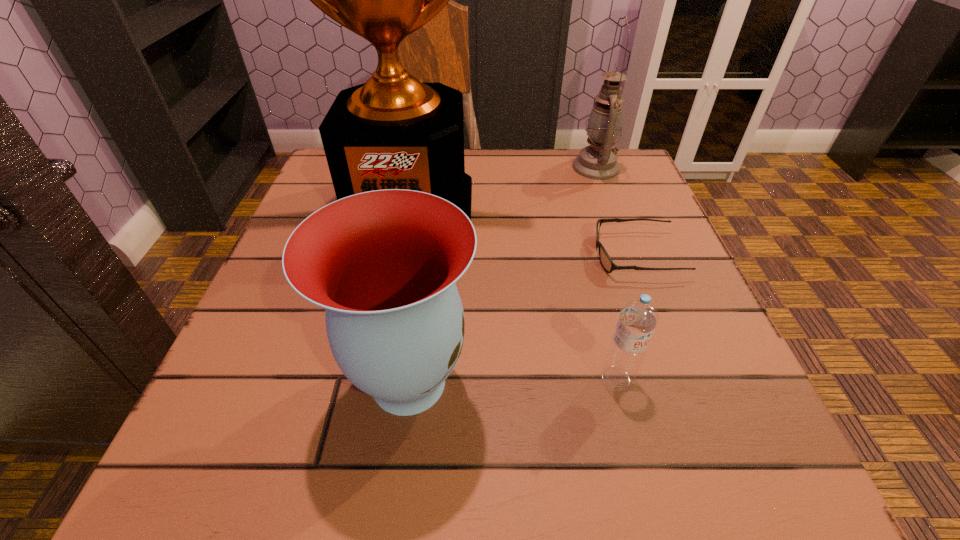
Find the location of a particular element. unoccupied area between the trophy cup and the water bottle is located at coordinates (512, 291).

Image resolution: width=960 pixels, height=540 pixels. Find the location of `vacant region between the third shortest object and the fourth tallest object`. vacant region between the third shortest object and the fourth tallest object is located at coordinates click(513, 381).

The image size is (960, 540). I want to click on blank region between the tallest object and the water bottle, so click(x=512, y=291).

At what (x,y) coordinates should I click in order to perform the action: click on vacant point located between the oil lamp and the second shortest object. Please return your answer as a coordinate pair (x, y). This screenshot has height=540, width=960. Looking at the image, I should click on (606, 273).

Locate which object is the closest to the second shortest object. Please provide its 2D coordinates. Your answer should be formatted as a tuple, i.e. [(x, y)], where the tuple contains the x and y coordinates of a point satisfying the conditions above.

[(606, 261)]

Image resolution: width=960 pixels, height=540 pixels. I want to click on object that is the third nearest to the third shortest object, so pos(606,261).

Locate an element on the screen. vacant space that satisfies the following two spatial constraints: 1. on the back side of the oil lamp; 2. on the left side of the second shortest object is located at coordinates (562, 167).